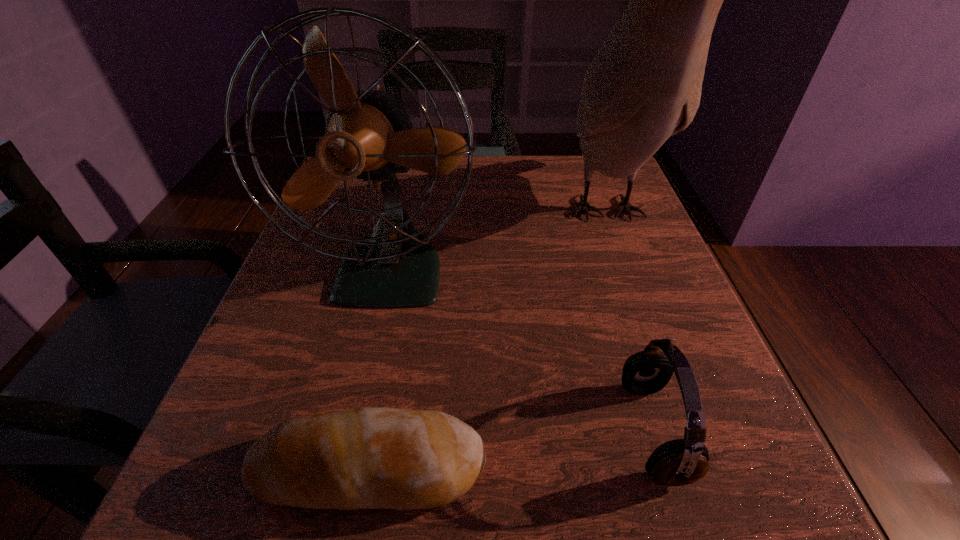
Identify the location of free space that satisfies the following two spatial constraints: 1. on the ear cups of the headset; 2. on the front side of the bread. The height and width of the screenshot is (540, 960). (664, 469).

Identify the location of free region that satisfies the following two spatial constraints: 1. on the front-facing side of the second tallest object for air flow; 2. on the right side of the shortest object. The width and height of the screenshot is (960, 540). (348, 469).